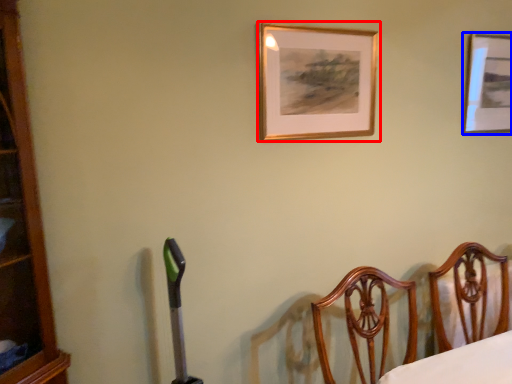
Question: Among these objects, which one is nearest to the camera, picture frame (highlighted by a red box) or picture frame (highlighted by a blue box)?

Choices:
 (A) picture frame
 (B) picture frame

Answer: (A)